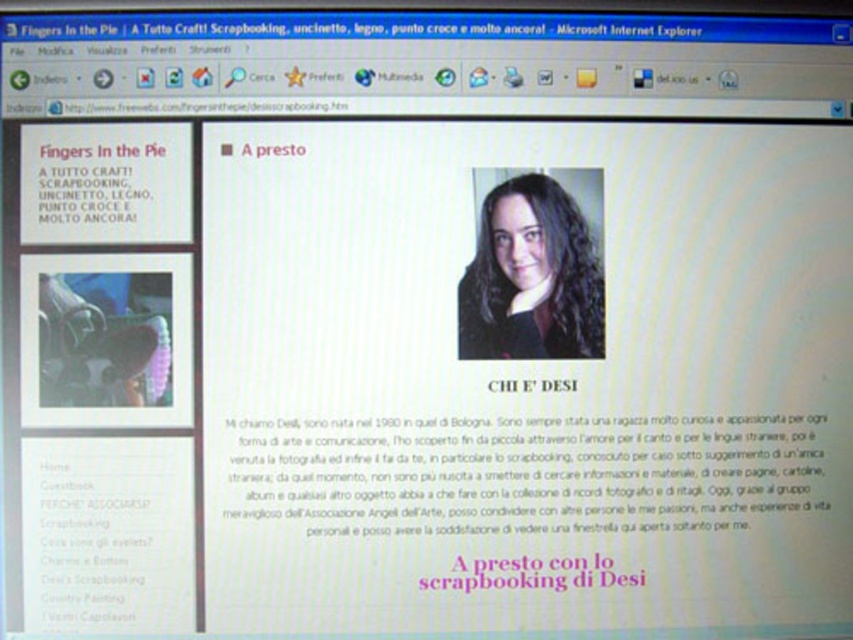
Does dark brown hair at center appear on the right side of whitetexttext at center?

In fact, dark brown hair at center is to the left of whitetexttext at center.

Does dark brown hair at center have a lesser height compared to whitetexttext at center?

In fact, dark brown hair at center may be taller than whitetexttext at center.

In order to click on dark brown hair at center in this screenshot , I will do `click(531, 276)`.

This screenshot has height=640, width=853. What are the coordinates of `dark brown hair at center` in the screenshot? It's located at (531, 276).

Does pink paper at center appear over whitetexttext at center?

Incorrect, pink paper at center is not positioned above whitetexttext at center.

Measure the distance between pink paper at center and whitetexttext at center.

pink paper at center is 6.84 inches from whitetexttext at center.

What do you see at coordinates (532, 573) in the screenshot? Image resolution: width=853 pixels, height=640 pixels. I see `pink paper at center` at bounding box center [532, 573].

Locate an element on the screen. pink paper at center is located at coordinates (532, 573).

Does dark brown hair at center have a lesser height compared to pink paper at center?

Incorrect, dark brown hair at center's height does not fall short of pink paper at center's.

Between dark brown hair at center and pink paper at center, which one is positioned lower?

Positioned lower is pink paper at center.

Between point (461, 308) and point (585, 586), which one is positioned behind?

The point (585, 586) is behind.

At what (x,y) coordinates should I click in order to perform the action: click on dark brown hair at center. Please return your answer as a coordinate pair (x, y). This screenshot has width=853, height=640. Looking at the image, I should click on (531, 276).